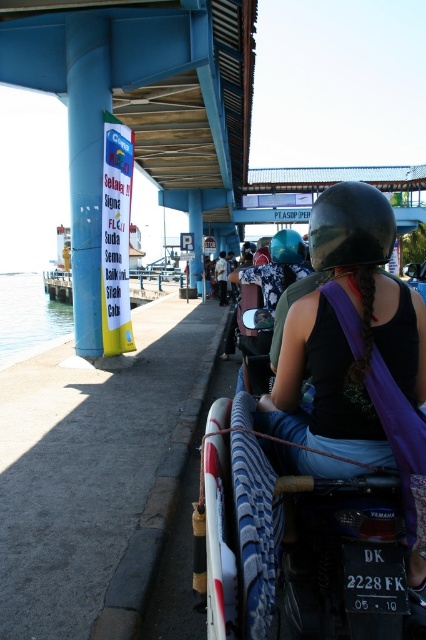
Question: Which of the following is the farthest from the observer?

Choices:
 (A) clear blue water at lower left
 (B) black glossy helmet at upper center

Answer: (A)

Question: Which point is farther to the camera?

Choices:
 (A) click(304, 252)
 (B) click(314, 412)

Answer: (A)

Question: Is black glossy helmet at upper center positioned behind clear blue water at lower left?

Choices:
 (A) yes
 (B) no

Answer: (B)

Question: Is matte black helmet at center thinner than black glossy helmet at upper center?

Choices:
 (A) yes
 (B) no

Answer: (B)

Question: Considering the real-world distances, which object is farthest from the clear blue water at lower left?

Choices:
 (A) matte black helmet at center
 (B) black glossy helmet at upper center

Answer: (B)

Question: Is matte black helmet at center positioned behind clear blue water at lower left?

Choices:
 (A) no
 (B) yes

Answer: (A)